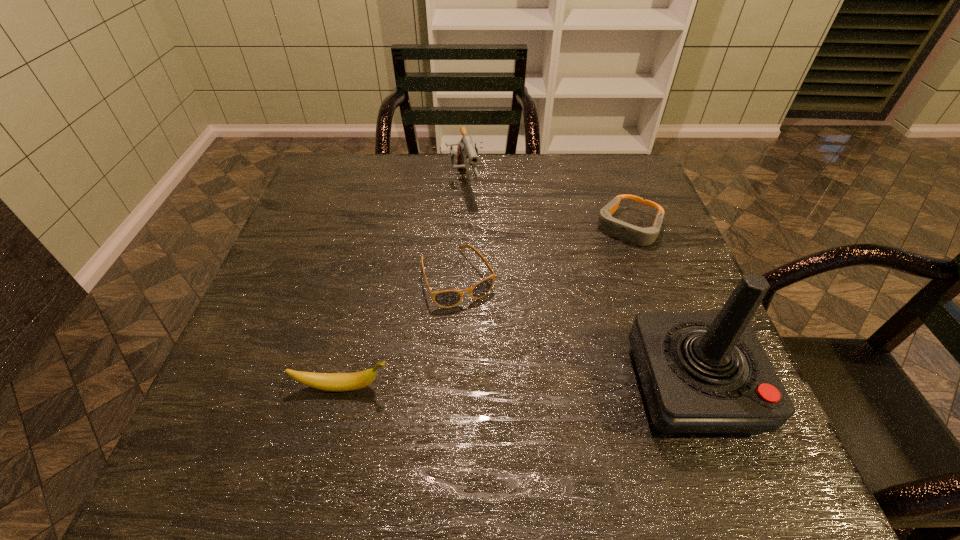
The image size is (960, 540). In order to click on free space between the sunglasses and the goggles in this screenshot , I will do `click(543, 253)`.

The width and height of the screenshot is (960, 540). In order to click on free point between the third tallest object and the fourth shortest object in this screenshot , I will do pos(401,286).

Locate an element on the screen. The image size is (960, 540). free spot between the goggles and the joystick is located at coordinates (660, 307).

At what (x,y) coordinates should I click in order to perform the action: click on free space between the banana and the second tallest object. Please return your answer as a coordinate pair (x, y). The image size is (960, 540). Looking at the image, I should click on (401, 286).

Find the location of a particular element. This screenshot has height=540, width=960. vacant point located between the tallest object and the goggles is located at coordinates click(x=660, y=307).

You are a GUI agent. You are given a task and a screenshot of the screen. Output one action in this format:
    pyautogui.click(x=<x>, y=<y>)
    Task: Click on the free spot between the sunglasses and the third shortest object
    This screenshot has height=540, width=960.
    Given the screenshot: What is the action you would take?
    pyautogui.click(x=400, y=332)

Locate an element on the screen. The width and height of the screenshot is (960, 540). free space between the goggles and the fourth shortest object is located at coordinates (544, 207).

Image resolution: width=960 pixels, height=540 pixels. I want to click on free spot between the joystick and the goggles, so click(x=660, y=307).

Where is `the third closest object relative to the sunglasses`? the third closest object relative to the sunglasses is located at coordinates (701, 373).

Locate an element on the screen. The width and height of the screenshot is (960, 540). object that is the second closest to the sunglasses is located at coordinates [337, 382].